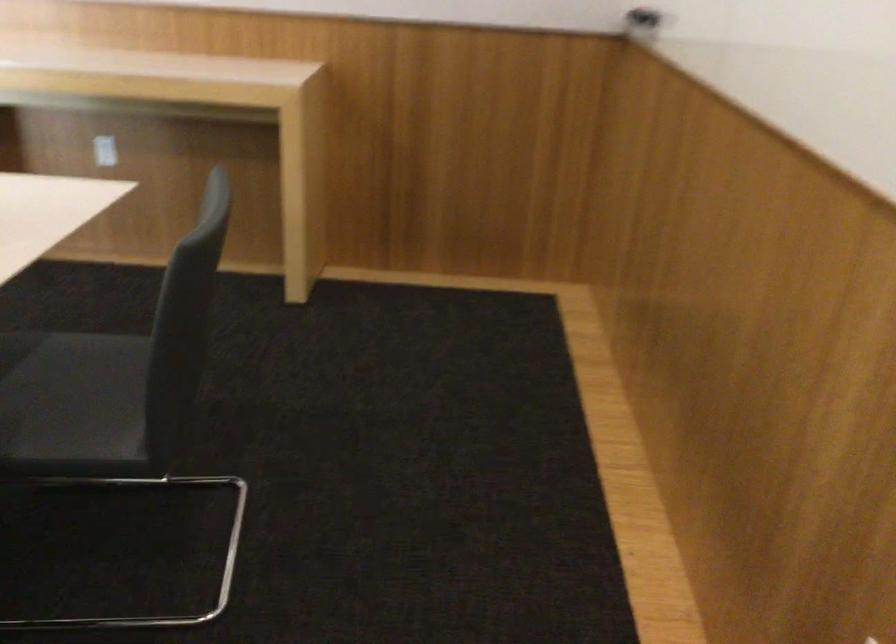
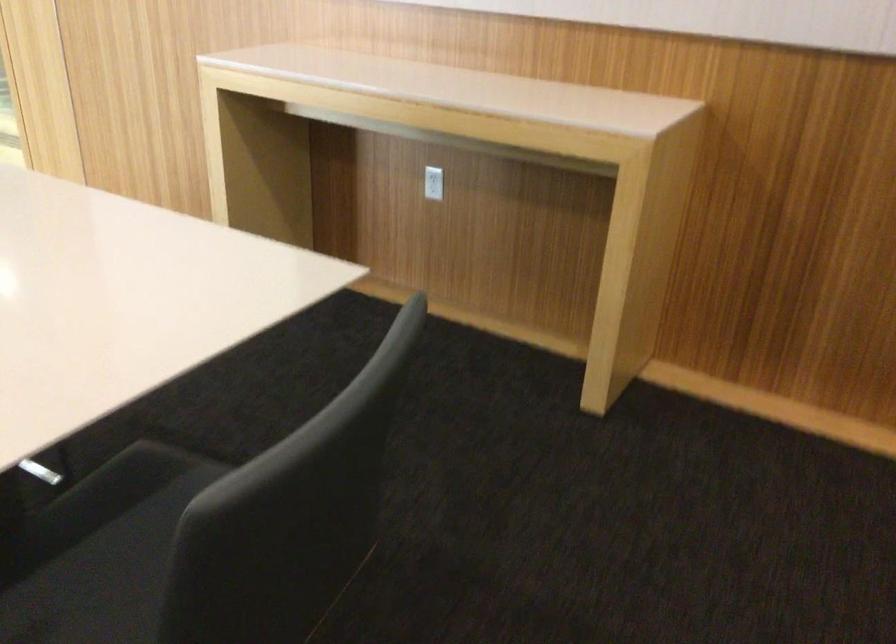
Question: The images are taken continuously from a first-person perspective. In which direction are you moving?

Choices:
 (A) Left
 (B) Right
 (C) Forward
 (D) Backward

Answer: (C)